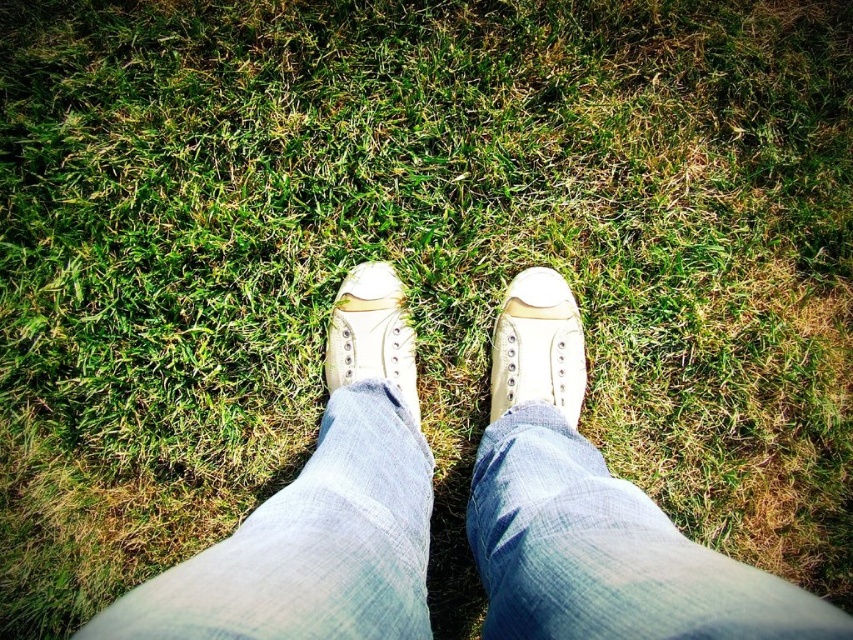
Who is higher up, denim at center or white canvas shoe at center?

Positioned higher is white canvas shoe at center.

Which is behind, point (352, 577) or point (527, 362)?

The point (527, 362) is more distant.

Is point (326, 605) closer to viewer compared to point (537, 337)?

Yes, point (326, 605) is closer to viewer.

You are a GUI agent. You are given a task and a screenshot of the screen. Output one action in this format:
    pyautogui.click(x=<x>, y=<y>)
    Task: Click on the denim at center
    Image resolution: width=853 pixels, height=640 pixels.
    Given the screenshot: What is the action you would take?
    pyautogui.click(x=607, y=552)

Is denim at center thinner than matte white sneaker at center?

Incorrect, denim at center's width is not less than matte white sneaker at center's.

Who is more forward, (549, 436) or (408, 401)?

Point (549, 436) is in front.

Where is `denim at center`? The width and height of the screenshot is (853, 640). denim at center is located at coordinates (607, 552).

Based on the photo, who is positioned more to the right, white canvas shoe at center or matte white sneaker at center?

white canvas shoe at center is more to the right.

Does white canvas shoe at center appear under matte white sneaker at center?

Incorrect, white canvas shoe at center is not positioned below matte white sneaker at center.

Which is behind, point (515, 326) or point (416, 404)?

Point (515, 326)

Where is `white canvas shoe at center`? Image resolution: width=853 pixels, height=640 pixels. white canvas shoe at center is located at coordinates (537, 346).